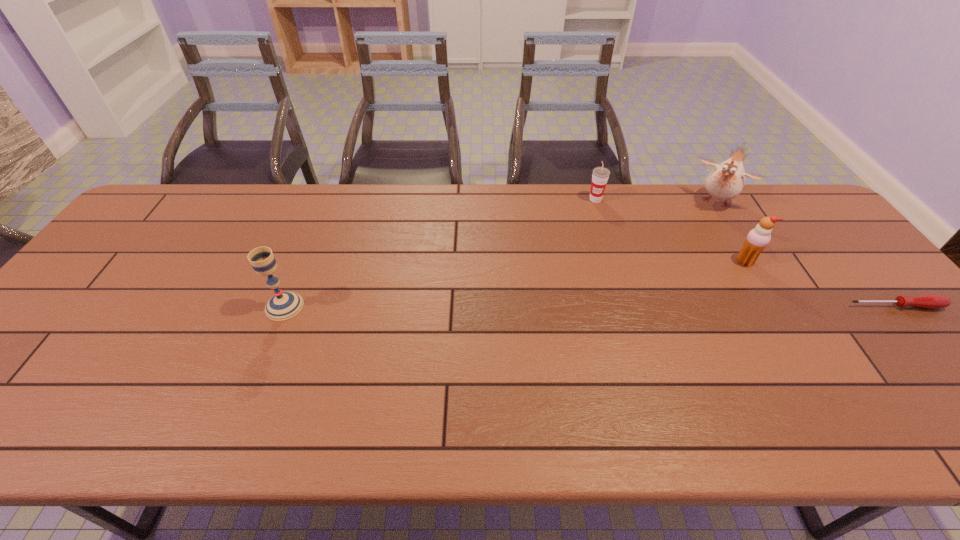
Image resolution: width=960 pixels, height=540 pixels. In order to click on blank area located at the beak of the bird in this screenshot , I will do `click(697, 230)`.

Locate an element on the screen. free spot located at the beak of the bird is located at coordinates (676, 263).

The image size is (960, 540). I want to click on vacant space located at the front with a straw on the icecream, so click(647, 324).

I want to click on vacant area located 0.130m at the front with a straw on the icecream, so click(709, 284).

The image size is (960, 540). Find the location of `vacant point located 0.290m at the front with a straw on the icecream`. vacant point located 0.290m at the front with a straw on the icecream is located at coordinates (669, 310).

Image resolution: width=960 pixels, height=540 pixels. Identify the location of blank space located on the side of the fourth object from right to left with the logo. (610, 286).

Where is `vacant point located on the side of the fourth object from right to left with the logo`? vacant point located on the side of the fourth object from right to left with the logo is located at coordinates (609, 281).

Where is `free region located on the side of the fourth object from right to left with the logo`? The height and width of the screenshot is (540, 960). free region located on the side of the fourth object from right to left with the logo is located at coordinates (606, 265).

This screenshot has width=960, height=540. I want to click on bird that is positioned at the far edge, so click(x=726, y=181).

Identify the location of cup that is at the far edge. The height and width of the screenshot is (540, 960). (600, 175).